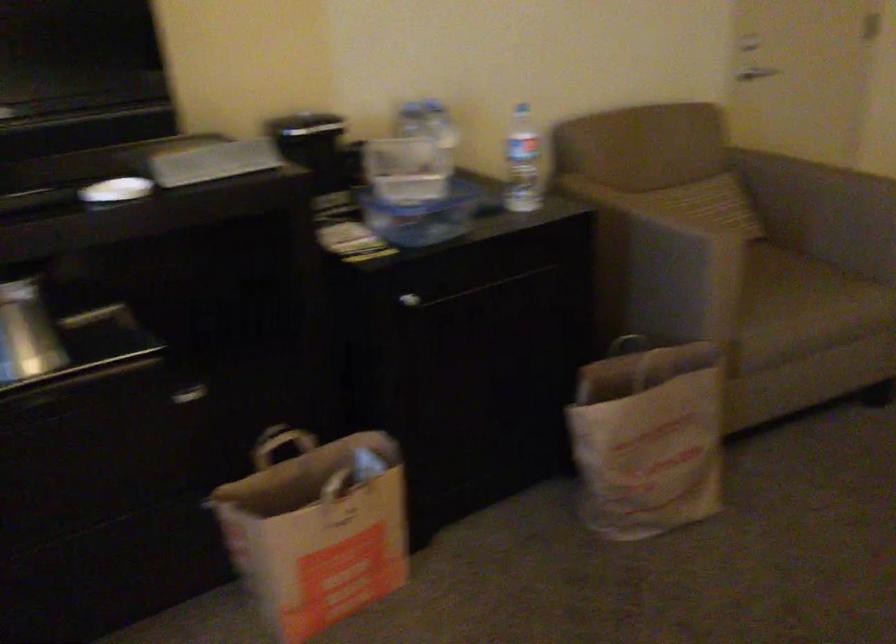
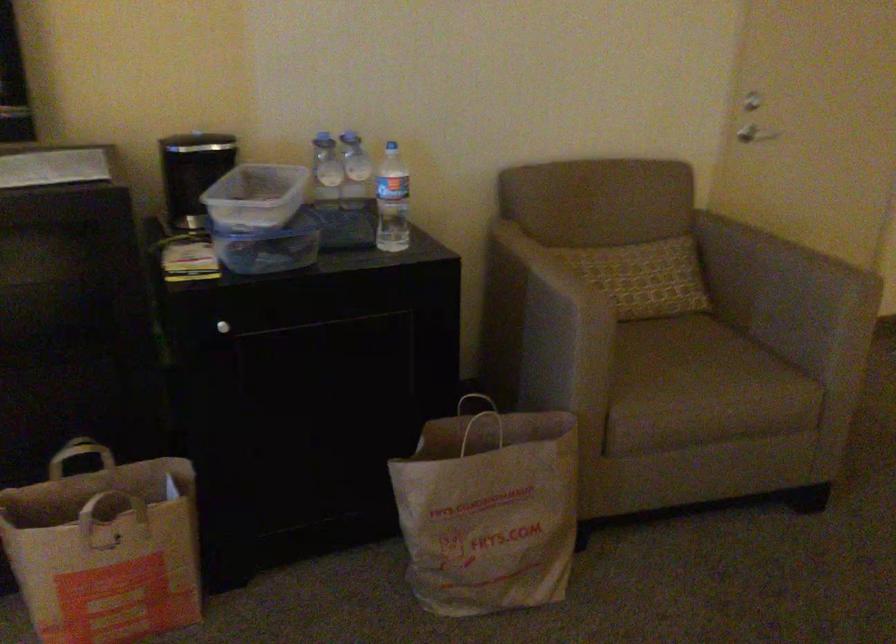
Where in the second image is the point corresponding to [797,281] from the first image?

(707, 366)